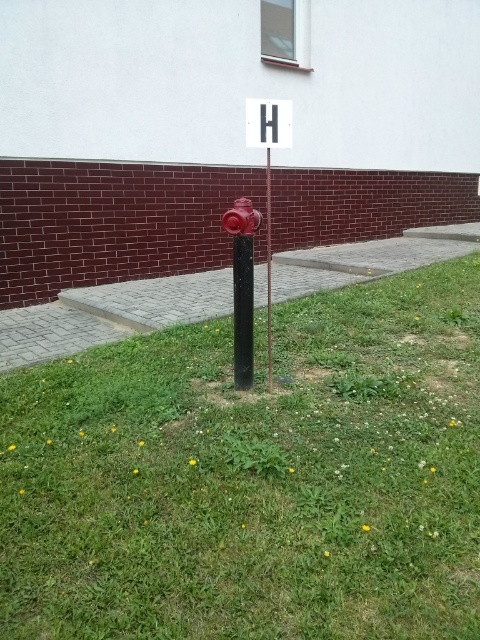
Question: Which point is farther to the camera?

Choices:
 (A) glossy red fire hydrant at center
 (B) white plastic sign at upper center
 (C) shiny red hydrant at center

Answer: (A)

Question: Is green grass at center smaller than black rubber pole at center?

Choices:
 (A) no
 (B) yes

Answer: (A)

Question: Which of the following is the farthest from the observer?

Choices:
 (A) shiny red hydrant at center
 (B) green grass at center

Answer: (A)

Question: Does metallic red fire hydrant at center appear over black rubber pole at center?

Choices:
 (A) yes
 (B) no

Answer: (A)

Question: Observing the image, what is the correct spatial positioning of white plastic sign at upper center in reference to black matte pole at center?

Choices:
 (A) right
 (B) left

Answer: (B)

Question: Which point is closer to the camera?

Choices:
 (A) (267, 129)
 (B) (231, 228)

Answer: (B)